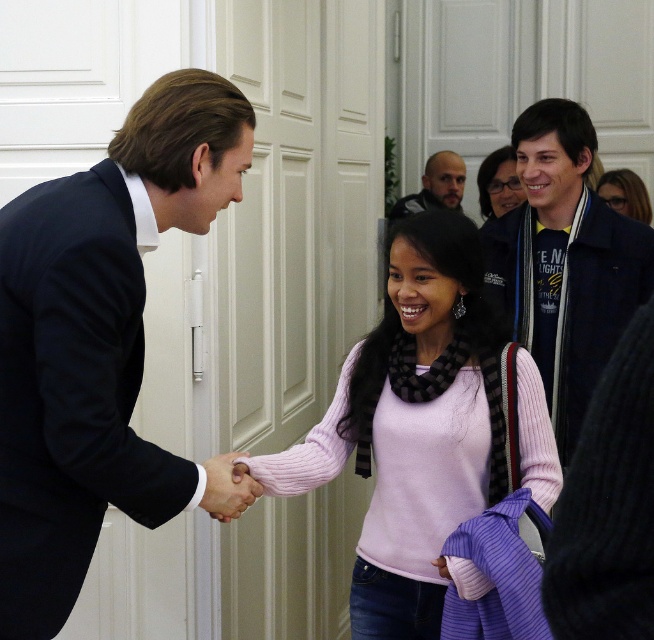
Between dark blue jacket at upper right and pink sweater at center, which one is positioned lower?

dark blue jacket at upper right is lower down.

Can you confirm if dark blue jacket at upper right is positioned above pink sweater at center?

Incorrect, dark blue jacket at upper right is not positioned above pink sweater at center.

Is point (581, 236) positioned in front of point (500, 212)?

Yes, it is in front of point (500, 212).

Image resolution: width=654 pixels, height=640 pixels. I want to click on dark blue jacket at upper right, so click(x=564, y=262).

Who is more forward, (250, 124) or (417, 440)?

Point (250, 124) is in front.

Does black suit at left appear under pink ribbed sweater at center?

No.

Describe the element at coordinates (97, 339) in the screenshot. I see `black suit at left` at that location.

You are a GUI agent. You are given a task and a screenshot of the screen. Output one action in this format:
    pyautogui.click(x=<x>, y=<y>)
    Task: Click on the black suit at left
    Image resolution: width=654 pixels, height=640 pixels.
    Given the screenshot: What is the action you would take?
    pyautogui.click(x=97, y=339)

Is pink ribbed sweater at center positioned behind dark blue jacket at upper right?

Result: No.

Is pink ribbed sweater at center in front of dark blue jacket at upper right?

Yes, pink ribbed sweater at center is closer to the viewer.

Does point (385, 476) lie in front of point (538, 186)?

Yes, point (385, 476) is in front of point (538, 186).

The width and height of the screenshot is (654, 640). I want to click on pink ribbed sweater at center, so click(411, 426).